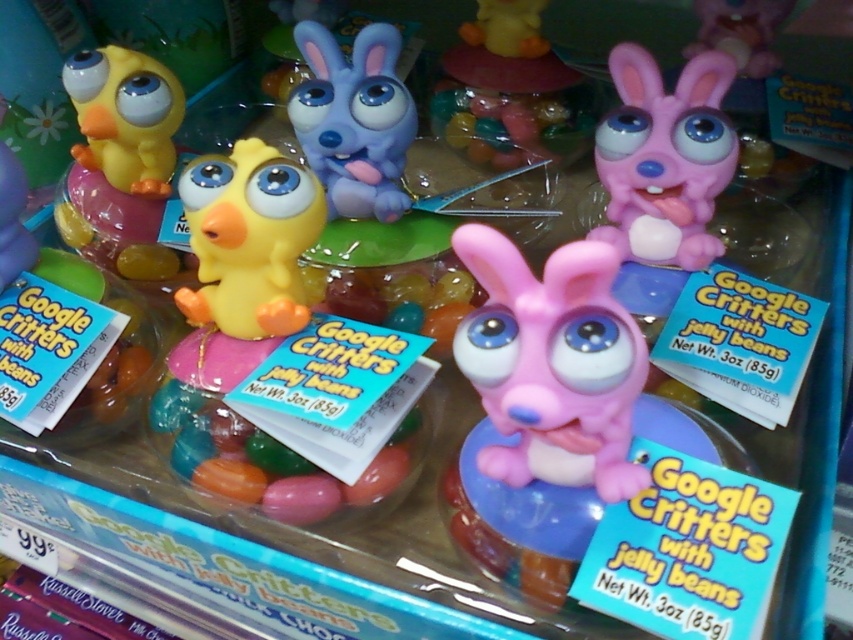
Question: Estimate the real-world distances between objects in this image. Which object is farther from the pink rubber bunny at upper center?

Choices:
 (A) matte yellow rubber duck at left
 (B) pink rubber bunny at upper right
 (C) matte yellow rubber duck at upper left

Answer: (A)

Question: Is matte pink plastic bunny at center wider than matte blue plastic bunny at center?

Choices:
 (A) no
 (B) yes

Answer: (B)

Question: Can you confirm if matte pink plastic bunny at center is thinner than matte yellow rubber duck at left?

Choices:
 (A) yes
 (B) no

Answer: (A)

Question: Among these points, which one is farthest from the camera?

Choices:
 (A) (297, 116)
 (B) (100, 195)

Answer: (B)

Question: Which point is farther to the camera?

Choices:
 (A) matte yellow rubber duck at left
 (B) matte yellow rubber duck at upper left
 (C) matte blue plastic bunny at center

Answer: (B)

Question: Is matte yellow rubber duck at left positioned in front of pink rubber bunny at upper center?

Choices:
 (A) yes
 (B) no

Answer: (A)